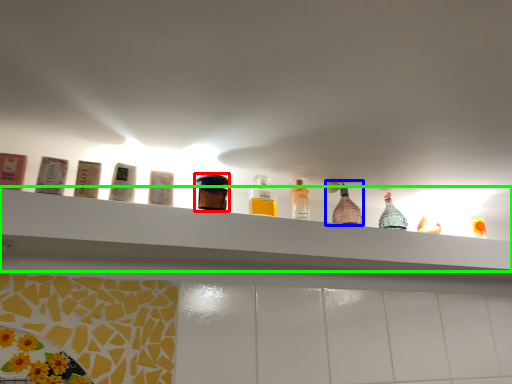
Question: Based on their relative distances, which object is nearer to bottle (highlighted by a red box)? Choose from bottle (highlighted by a blue box) and shelf (highlighted by a green box).

Choices:
 (A) bottle
 (B) shelf

Answer: (B)